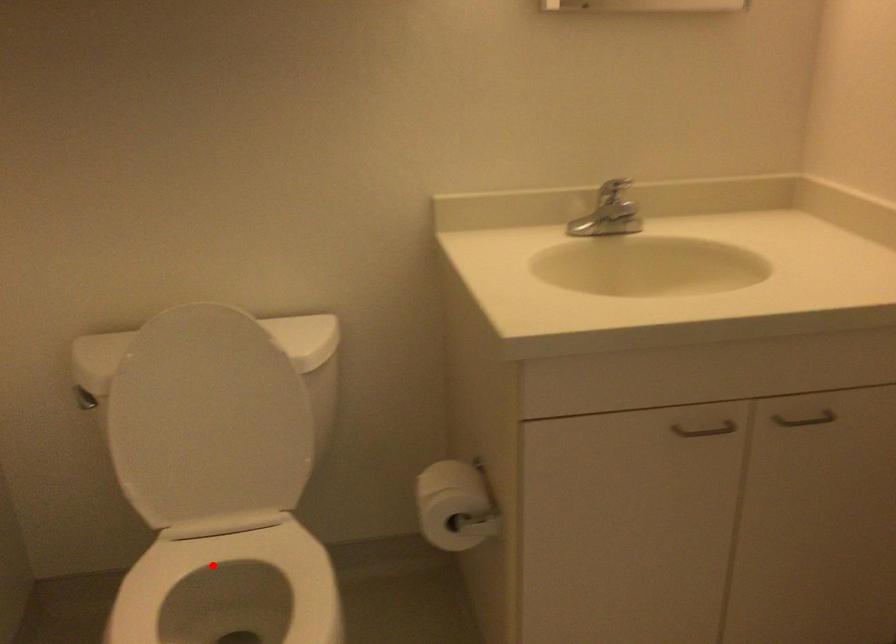
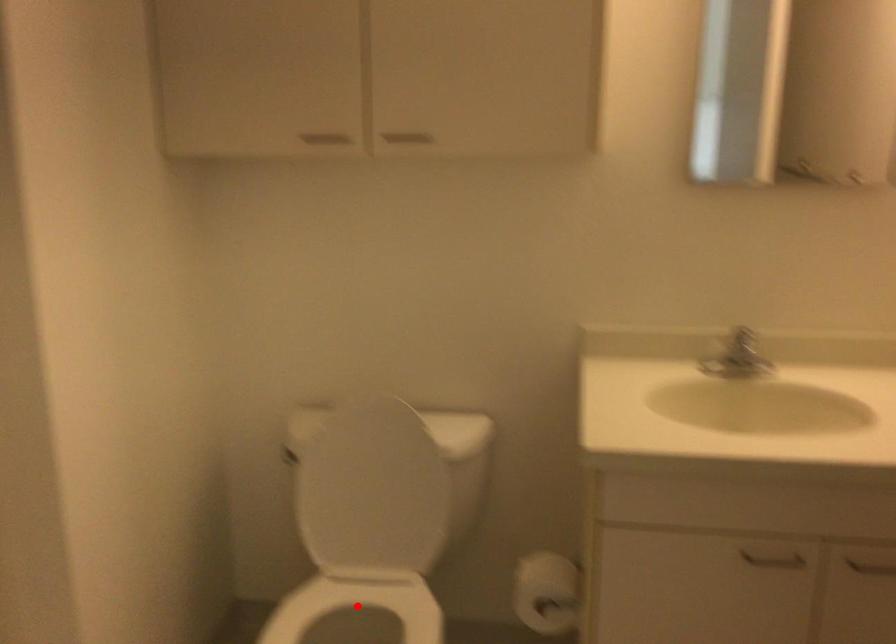
I am providing you with two images of the same scene from different viewpoints. A red point is marked on the first image and another point is marked on the second image. Is the red point in image1 aligned with the point shown in image2?

Yes